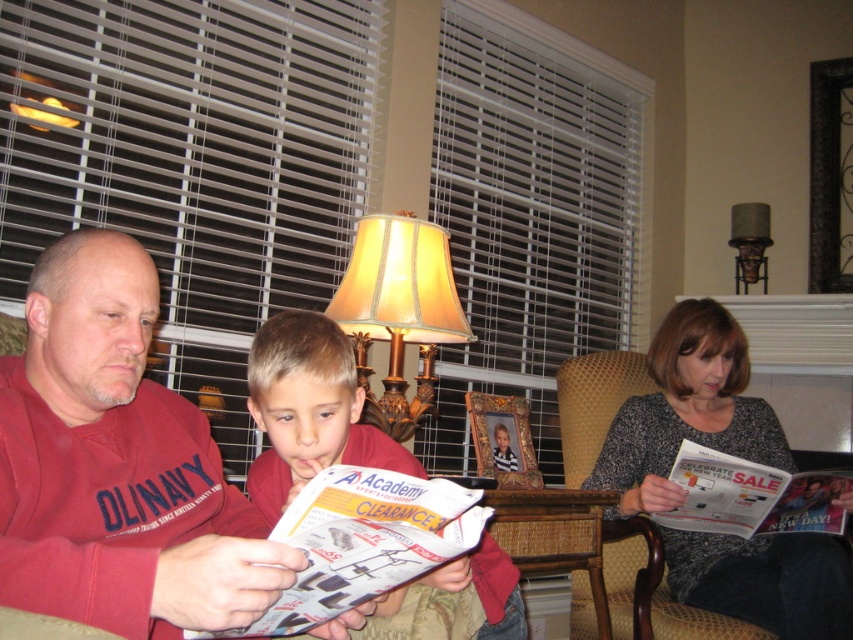
Is point (668, 586) positioned behind point (323, 448)?

Yes.

The image size is (853, 640). What do you see at coordinates (686, 410) in the screenshot? I see `speckled gray sweater at center` at bounding box center [686, 410].

This screenshot has width=853, height=640. Describe the element at coordinates (686, 410) in the screenshot. I see `speckled gray sweater at center` at that location.

The height and width of the screenshot is (640, 853). What are the coordinates of `speckled gray sweater at center` in the screenshot? It's located at (686, 410).

Can you confirm if white glossy magazine at center is taller than matte beige lampshade at center?

Incorrect, white glossy magazine at center's height is not larger of matte beige lampshade at center's.

Who is higher up, white glossy magazine at center or matte beige lampshade at center?

matte beige lampshade at center is above.

Locate an element on the screen. white glossy magazine at center is located at coordinates (363, 541).

Is matte red shirt at center shorter than matte paper magazine at lower right?

No, matte red shirt at center is not shorter than matte paper magazine at lower right.

Is point (492, 637) positioned before point (773, 529)?

Yes, it is in front of point (773, 529).

Locate an element on the screen. matte red shirt at center is located at coordinates (309, 410).